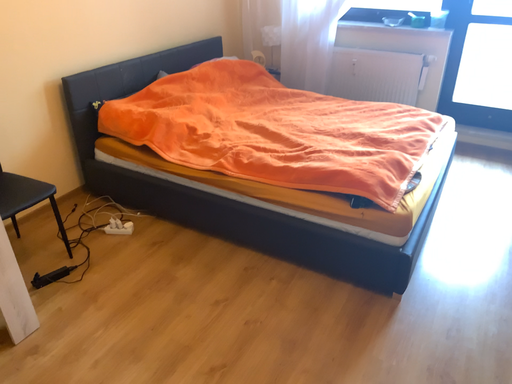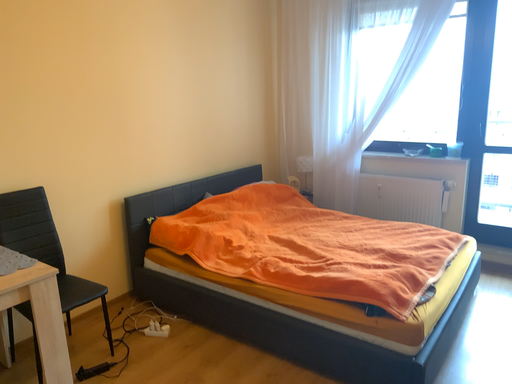
Question: Which way did the camera rotate in the video?

Choices:
 (A) rotated left
 (B) rotated right

Answer: (A)